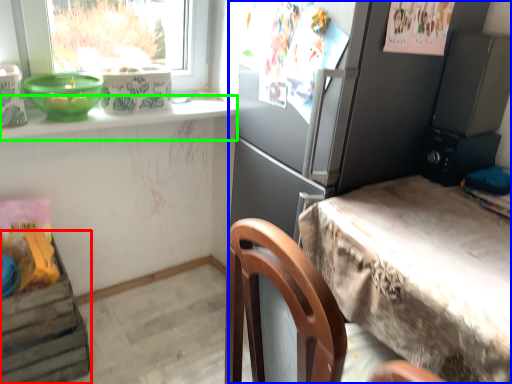
Question: Which is nearer to the shelf (highlighted by a red box)? cabinetry (highlighted by a blue box) or window sill (highlighted by a green box).

Choices:
 (A) cabinetry
 (B) window sill

Answer: (B)